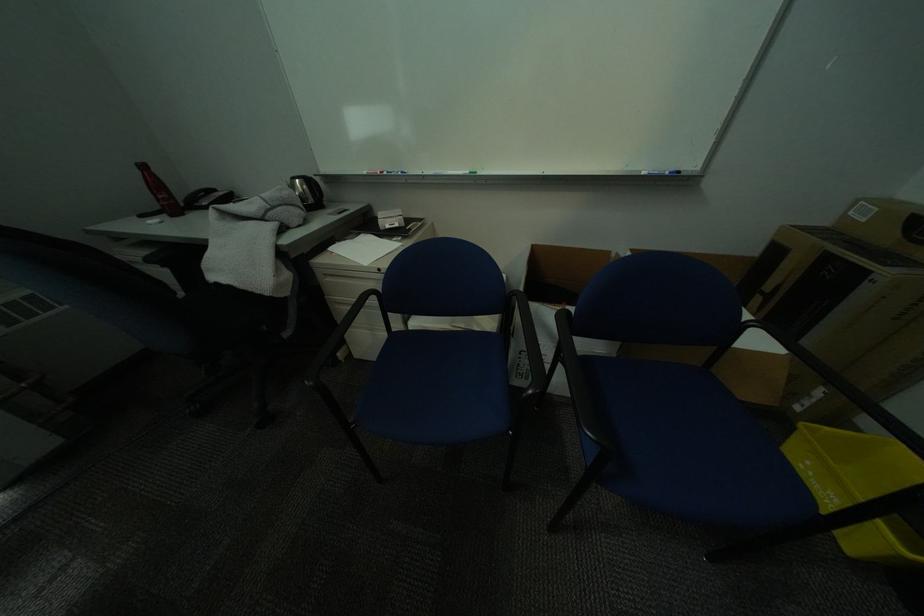
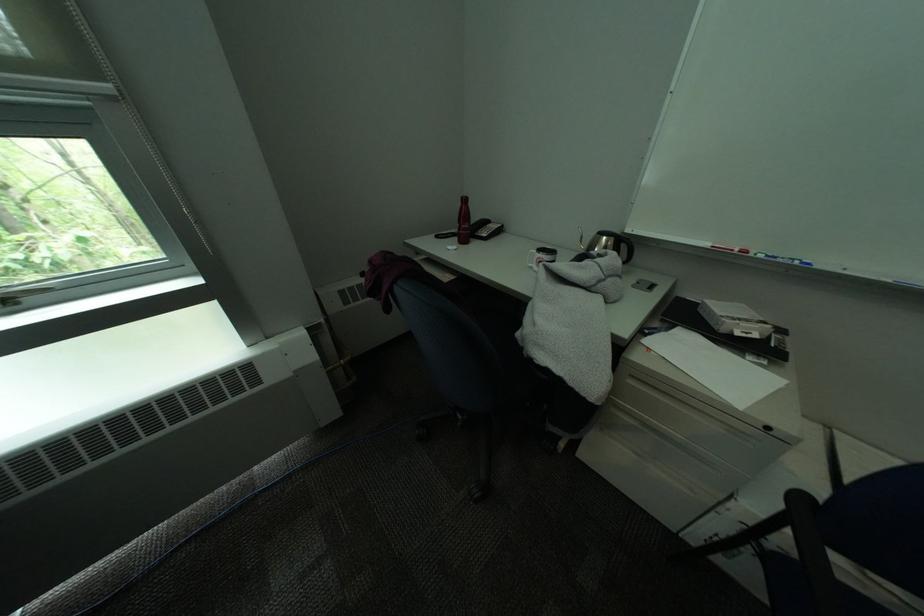
Locate, in the second image, the point that corresponds to pixel 172 198 in the first image.

(475, 228)